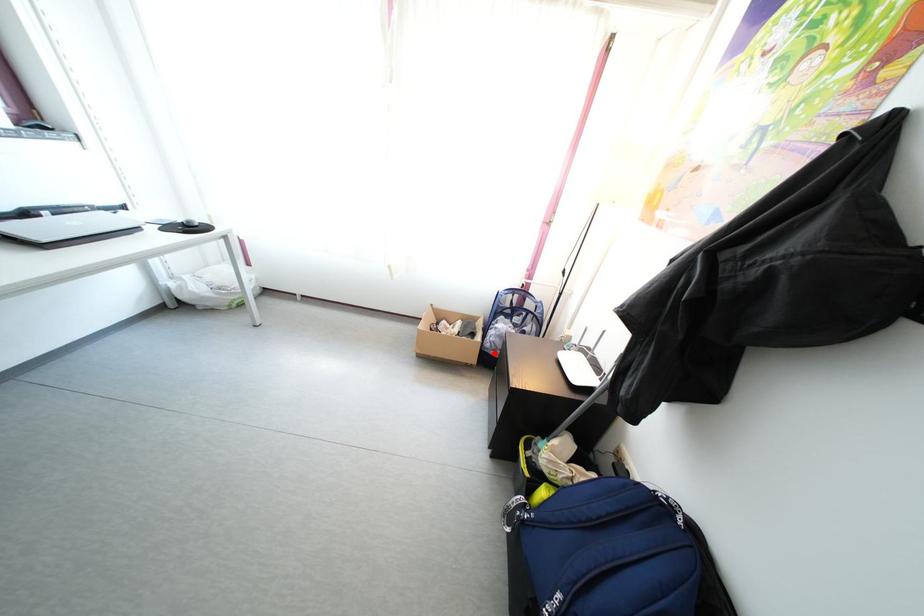
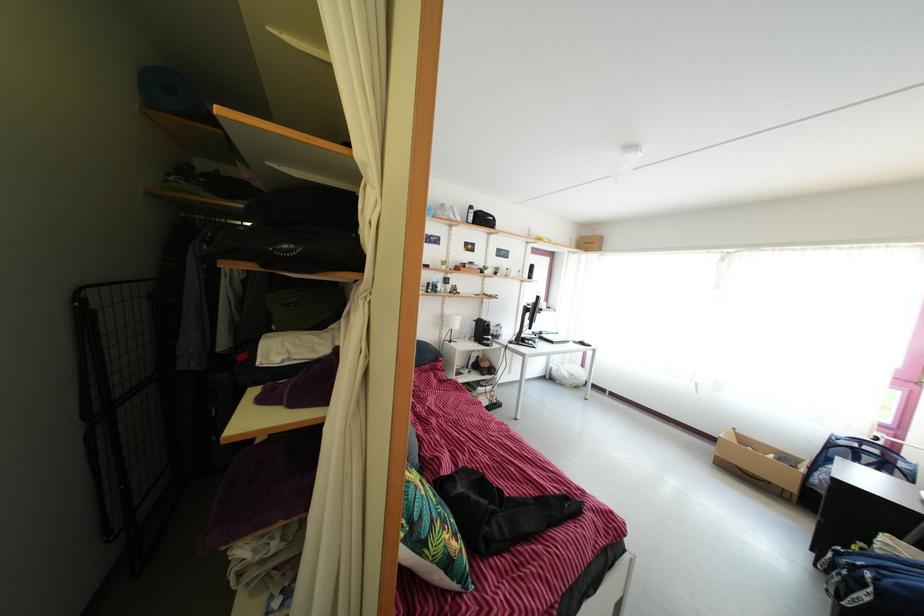
The point at the highlighted location is marked in the first image. Where is the corresponding point in the second image?

(821, 488)